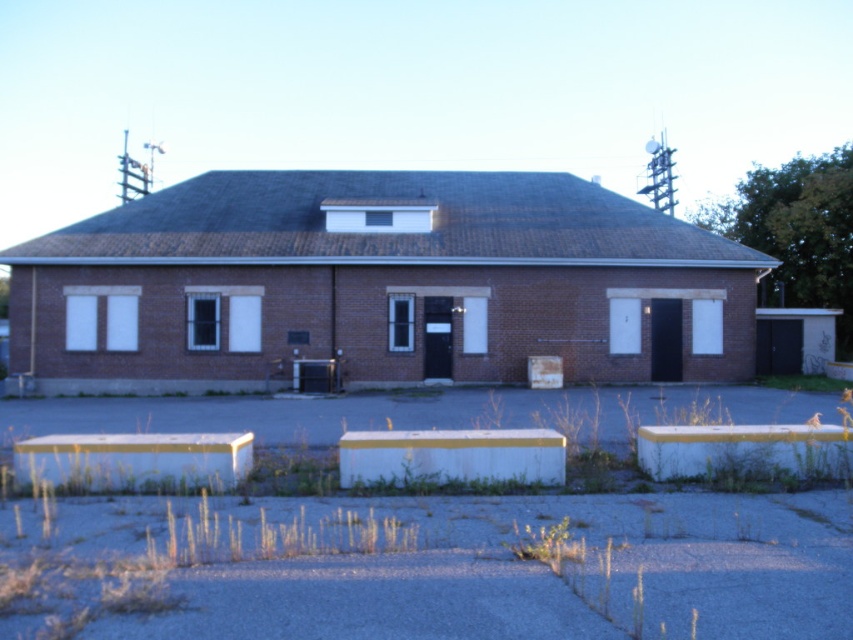
Question: Is brown brick building at center bigger than white concrete curb at lower right?

Choices:
 (A) no
 (B) yes

Answer: (B)

Question: Which point is farther from the camera taking this photo?

Choices:
 (A) (834, 461)
 (B) (651, 268)

Answer: (B)

Question: Which of the following is the farthest from the observer?

Choices:
 (A) white concrete curb at lower right
 (B) brown brick building at center

Answer: (B)

Question: Is the position of brown brick building at center less distant than that of white concrete curb at lower right?

Choices:
 (A) yes
 (B) no

Answer: (B)

Question: Is brown brick building at center thinner than white concrete curb at lower right?

Choices:
 (A) yes
 (B) no

Answer: (B)